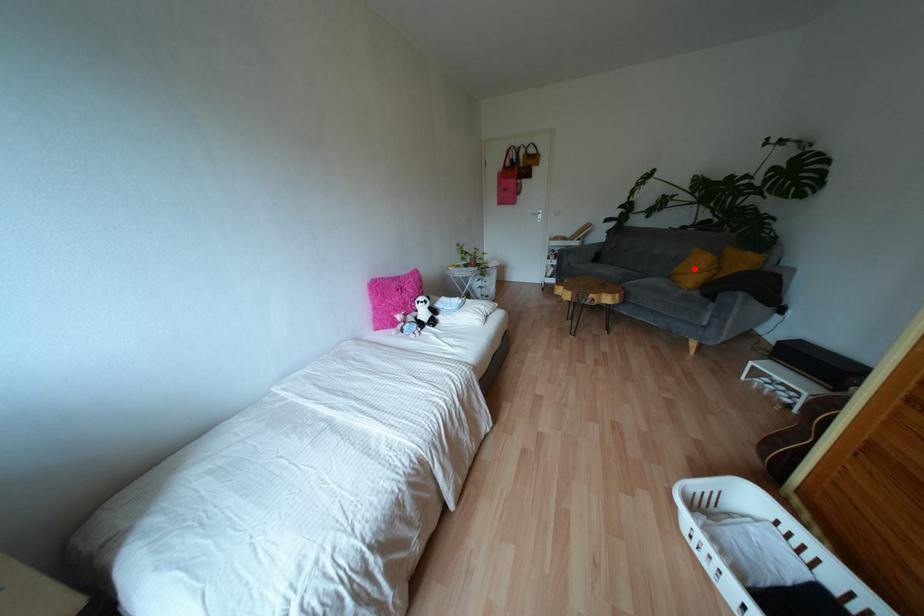
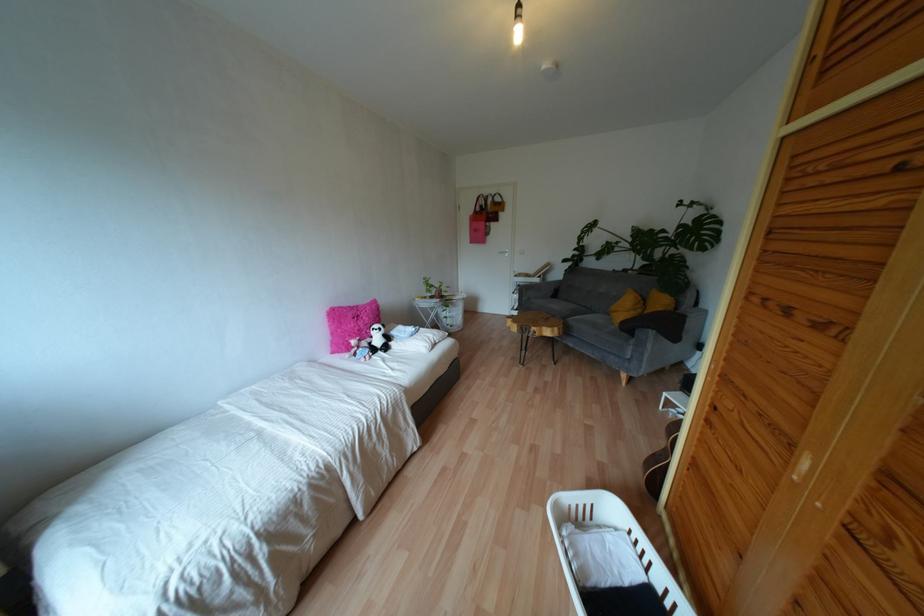
Question: I am providing you with two images of the same scene from different viewpoints. Image1 has a red point marked. In image2, the corresponding 3D location appears at what relative position? Reply with the corresponding letter.

Choices:
 (A) Closer
 (B) Farther

Answer: (A)